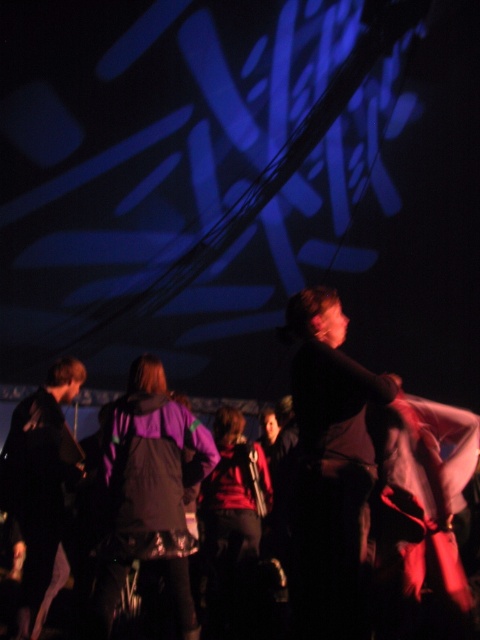
Can you confirm if dark fabric shirt at center is taller than black matte jacket at lower left?

No, dark fabric shirt at center is not taller than black matte jacket at lower left.

Is dark fabric shirt at center wider than black matte jacket at lower left?

Correct, the width of dark fabric shirt at center exceeds that of black matte jacket at lower left.

What are the coordinates of `dark fabric shirt at center` in the screenshot? It's located at pos(331,468).

Can you confirm if dark fabric shirt at center is shorter than purple matte jacket at center?

Yes.

Can you confirm if dark fabric shirt at center is positioned above purple matte jacket at center?

Yes.

What do you see at coordinates (331, 468) in the screenshot? The image size is (480, 640). I see `dark fabric shirt at center` at bounding box center [331, 468].

Locate an element on the screen. The width and height of the screenshot is (480, 640). dark fabric shirt at center is located at coordinates (331, 468).

Does black matte jacket at center appear on the left side of black matte jacket at lower left?

No, black matte jacket at center is not to the left of black matte jacket at lower left.

You are a GUI agent. You are given a task and a screenshot of the screen. Output one action in this format:
    pyautogui.click(x=<x>, y=<y>)
    Task: Click on the black matte jacket at center
    This screenshot has width=480, height=640.
    Given the screenshot: What is the action you would take?
    pyautogui.click(x=368, y=480)

At what (x,y) coordinates should I click in order to perform the action: click on black matte jacket at center. Please return your answer as a coordinate pair (x, y). Looking at the image, I should click on (368, 480).